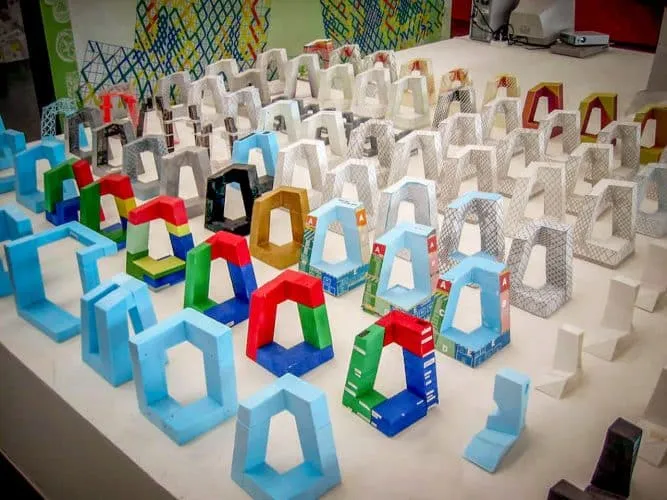
Where is `tabletop`? The width and height of the screenshot is (667, 500). tabletop is located at coordinates (433, 471).